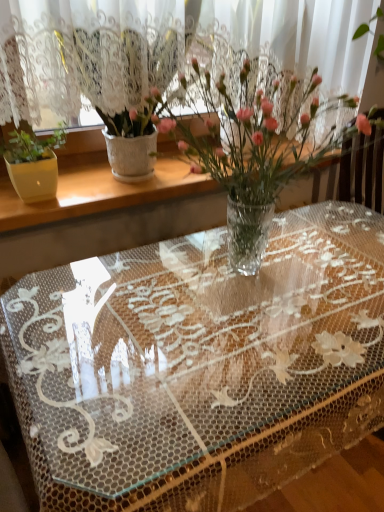
Locate an element on the screen. Image resolution: width=384 pixels, height=512 pixels. empty space that is ontop of transparent lace tablecloth at center (from a real-world perspective) is located at coordinates (206, 298).